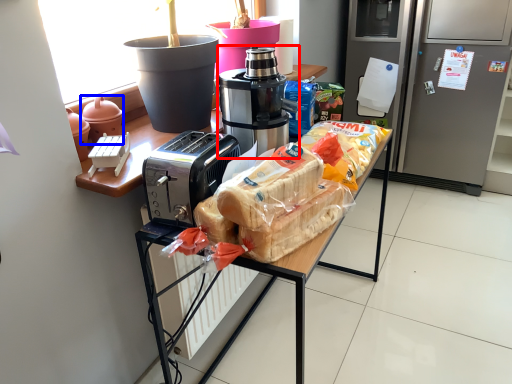
Question: Among these objects, which one is nearest to the camera, coffee maker (highlighted by a red box) or appliance (highlighted by a blue box)?

Choices:
 (A) coffee maker
 (B) appliance

Answer: (A)